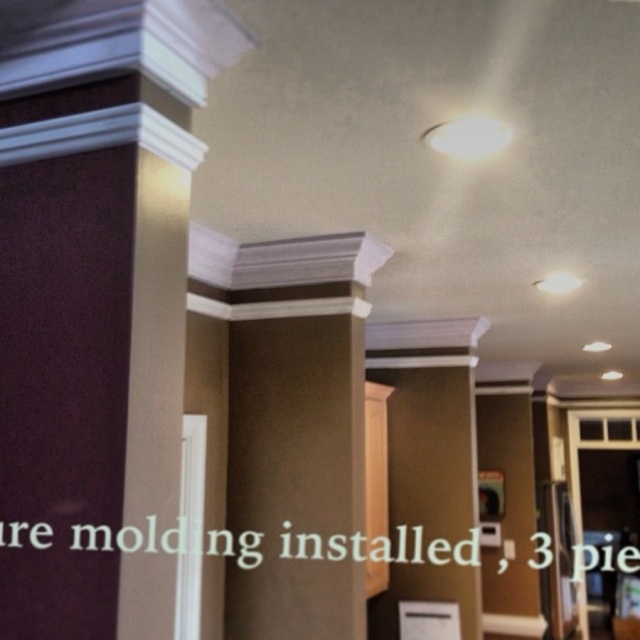
You are an interior designer assessing the space. You notice the white glossy column at upper left and the white glossy crown molding at upper center. Which of these two elements takes up more visual space in the room?

The white glossy crown molding at upper center occupies more visual space than the white glossy column at upper left.

You are an interior designer assessing the space. You need to determine if the white glossy column at upper left can fit into the space currently occupied by the white glossy crown molding at upper center. Based on their widths, what would you advise?

The white glossy column at upper left has a lesser width compared to the white glossy crown molding at upper center. Therefore, the column can fit into the space occupied by the crown molding since it is narrower.

You are standing in the room and want to touch both the white glossy column at upper left and the white glossy crown molding at upper center. Which one can you reach first without moving your position?

You can reach the white glossy column at upper left first because it is closer to you than the white glossy crown molding at upper center.